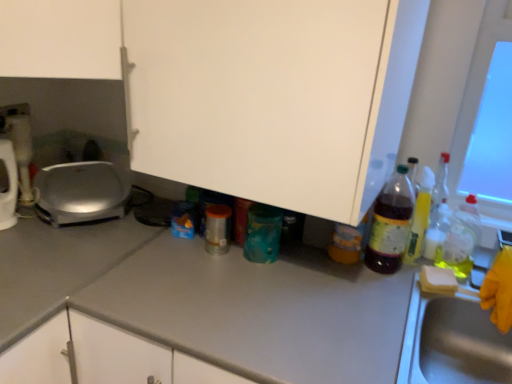
Question: From a real-world perspective, is white glossy kettle at left, the first appliance positioned from the left, on top of yellow sponge at right?

Choices:
 (A) yes
 (B) no

Answer: (A)

Question: Can you confirm if white glossy kettle at left, the first appliance positioned from the left, is shorter than yellow sponge at right?

Choices:
 (A) no
 (B) yes

Answer: (A)

Question: Is white glossy kettle at left, the first appliance positioned from the left, positioned in front of yellow sponge at right?

Choices:
 (A) no
 (B) yes

Answer: (A)

Question: From a real-world perspective, is white glossy kettle at left, the first appliance positioned from the left, under yellow sponge at right?

Choices:
 (A) yes
 (B) no

Answer: (B)

Question: Can you confirm if white glossy kettle at left, the first appliance positioned from the left, is thinner than yellow sponge at right?

Choices:
 (A) no
 (B) yes

Answer: (A)

Question: Is white glossy kettle at left, the first appliance positioned from the left, turned away from yellow sponge at right?

Choices:
 (A) no
 (B) yes

Answer: (A)

Question: Is yellow sponge at right closer to the viewer compared to metallic silver can at center, which appears as the 1th bottle when viewed from the left?

Choices:
 (A) no
 (B) yes

Answer: (B)

Question: Considering the relative sizes of yellow sponge at right and metallic silver can at center, which appears as the 1th bottle when viewed from the left, in the image provided, is yellow sponge at right smaller than metallic silver can at center, which appears as the 1th bottle when viewed from the left,?

Choices:
 (A) no
 (B) yes

Answer: (B)

Question: Is yellow sponge at right oriented away from metallic silver can at center, which appears as the 1th bottle when viewed from the left?

Choices:
 (A) yes
 (B) no

Answer: (B)

Question: Is the position of yellow sponge at right more distant than that of metallic silver can at center, which appears as the 1th bottle when viewed from the left?

Choices:
 (A) no
 (B) yes

Answer: (A)

Question: Is yellow sponge at right located outside metallic silver can at center, which appears as the 1th bottle when viewed from the left?

Choices:
 (A) yes
 (B) no

Answer: (A)

Question: Is yellow sponge at right at the right side of metallic silver can at center, the fifth bottle viewed from the right?

Choices:
 (A) no
 (B) yes

Answer: (B)

Question: Is metallic stainless steel sink at right to the right of metallic silver toaster at left, the second appliance viewed from the left, from the viewer's perspective?

Choices:
 (A) no
 (B) yes

Answer: (B)